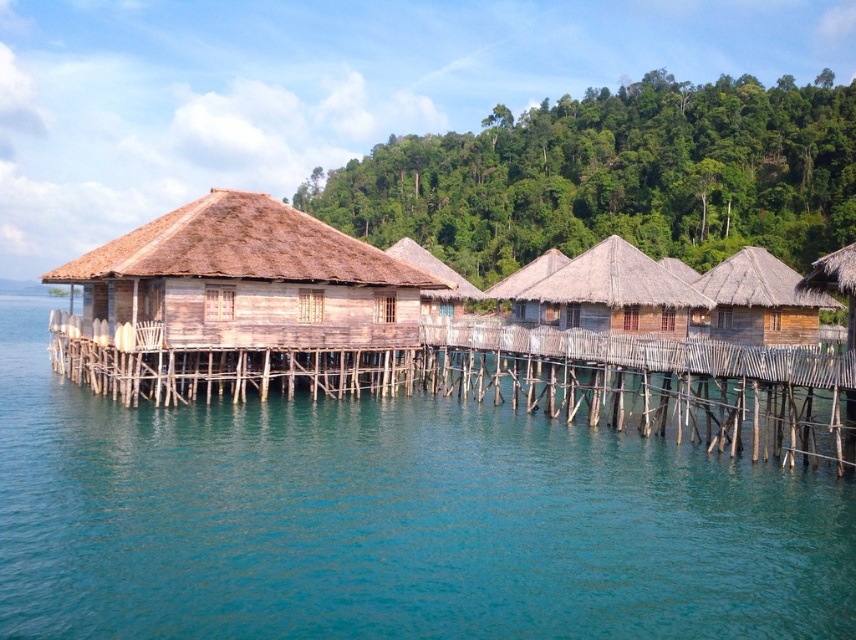
Question: Does clear blue water at lower left have a lesser width compared to wooden thatched hut at right?

Choices:
 (A) yes
 (B) no

Answer: (B)

Question: From the image, what is the correct spatial relationship of wooden hut at center in relation to brown thatch hut at center?

Choices:
 (A) left
 (B) right

Answer: (A)

Question: Which point is farther from the camera taking this photo?

Choices:
 (A) (518, 284)
 (B) (836, 291)
 (C) (700, 292)
 (D) (241, 282)

Answer: (A)

Question: Is wooden dock at center to the right of brown wooden hut at right from the viewer's perspective?

Choices:
 (A) no
 (B) yes

Answer: (A)

Question: Among these points, which one is nearest to the camera?

Choices:
 (A) (771, 264)
 (B) (274, 582)
 (C) (848, 260)

Answer: (B)

Question: Which point appears closest to the camera in this image?

Choices:
 (A) (533, 269)
 (B) (611, 240)
 (C) (774, 328)
 (D) (815, 276)

Answer: (D)